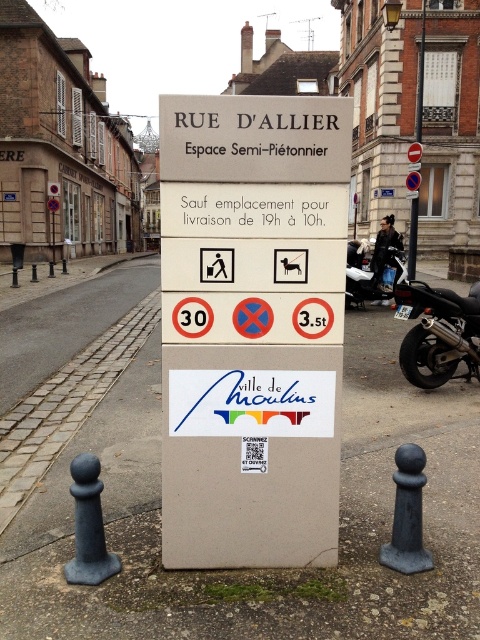
What is the spatial relationship between the beige plastic sign at center and the black metallic motorcycle at right?

The beige plastic sign at center is above the black metallic motorcycle at right.

What is the spatial relationship between the beige plastic sign at center and the metallic pole at center in the street scene?

The beige plastic sign at center is in front of the metallic pole at center.